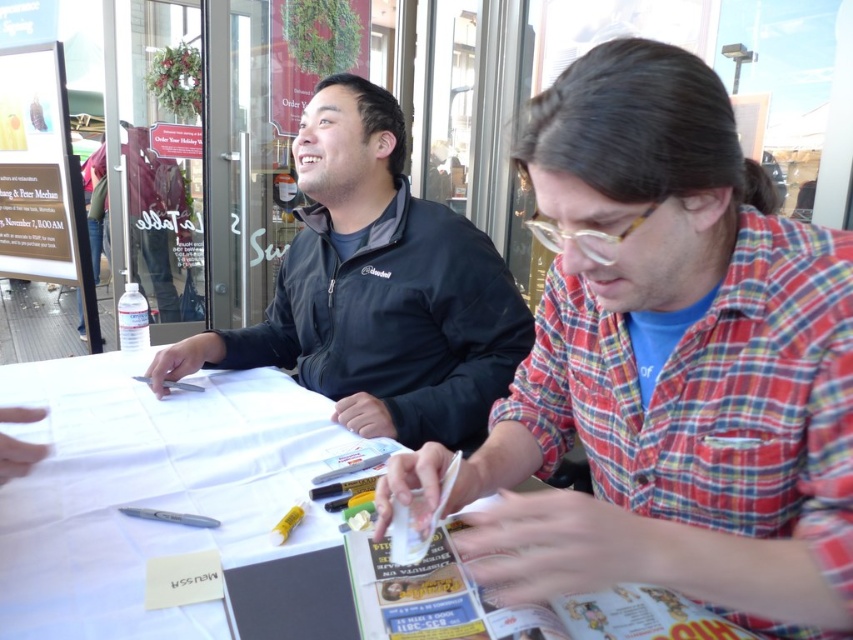
Is plaid shirt at center to the left of black softshell jacket at upper center from the viewer's perspective?

Incorrect, plaid shirt at center is not on the left side of black softshell jacket at upper center.

The width and height of the screenshot is (853, 640). What do you see at coordinates (671, 364) in the screenshot?
I see `plaid shirt at center` at bounding box center [671, 364].

Locate an element on the screen. plaid shirt at center is located at coordinates (671, 364).

Is plaid shirt at center to the right of matte white sign at upper left from the viewer's perspective?

Correct, you'll find plaid shirt at center to the right of matte white sign at upper left.

The image size is (853, 640). In order to click on plaid shirt at center in this screenshot , I will do `click(671, 364)`.

You are a GUI agent. You are given a task and a screenshot of the screen. Output one action in this format:
    pyautogui.click(x=<x>, y=<y>)
    Task: Click on the plaid shirt at center
    
    Given the screenshot: What is the action you would take?
    point(671,364)

Does black softshell jacket at upper center have a greater width compared to matte white sign at upper left?

Yes, black softshell jacket at upper center is wider than matte white sign at upper left.

The height and width of the screenshot is (640, 853). Describe the element at coordinates (376, 289) in the screenshot. I see `black softshell jacket at upper center` at that location.

The width and height of the screenshot is (853, 640). What do you see at coordinates (376, 289) in the screenshot?
I see `black softshell jacket at upper center` at bounding box center [376, 289].

The image size is (853, 640). Identify the location of black softshell jacket at upper center. (376, 289).